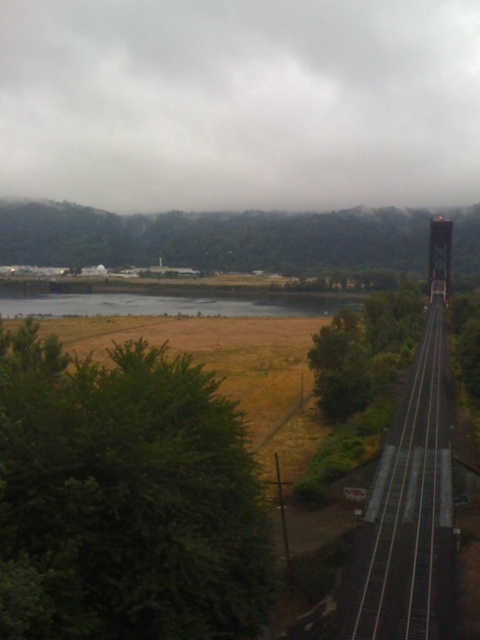
Which of these two, green leafy tree at center or metal/smooth track at right, stands taller?

With more height is green leafy tree at center.

Image resolution: width=480 pixels, height=640 pixels. What are the coordinates of `green leafy tree at center` in the screenshot? It's located at (215, 237).

In the scene shown: Can you confirm if green leafy tree at center is bigger than green leafy tree at center-right?

Correct, green leafy tree at center is larger in size than green leafy tree at center-right.

What do you see at coordinates (215, 237) in the screenshot?
I see `green leafy tree at center` at bounding box center [215, 237].

Where is `green leafy tree at center`? The width and height of the screenshot is (480, 640). green leafy tree at center is located at coordinates (215, 237).

At what (x,y) coordinates should I click in order to perform the action: click on green leafy tree at center. Please return your answer as a coordinate pair (x, y). Image resolution: width=480 pixels, height=640 pixels. Looking at the image, I should click on (215, 237).

Between green leafy tree at lower left and brushed metal water tower at right, which one is positioned higher?

brushed metal water tower at right is higher up.

Is point (264, 602) farther from viewer compared to point (437, 253)?

No, (264, 602) is in front of (437, 253).

Where is `green leafy tree at lower left`? This screenshot has width=480, height=640. green leafy tree at lower left is located at coordinates (126, 497).